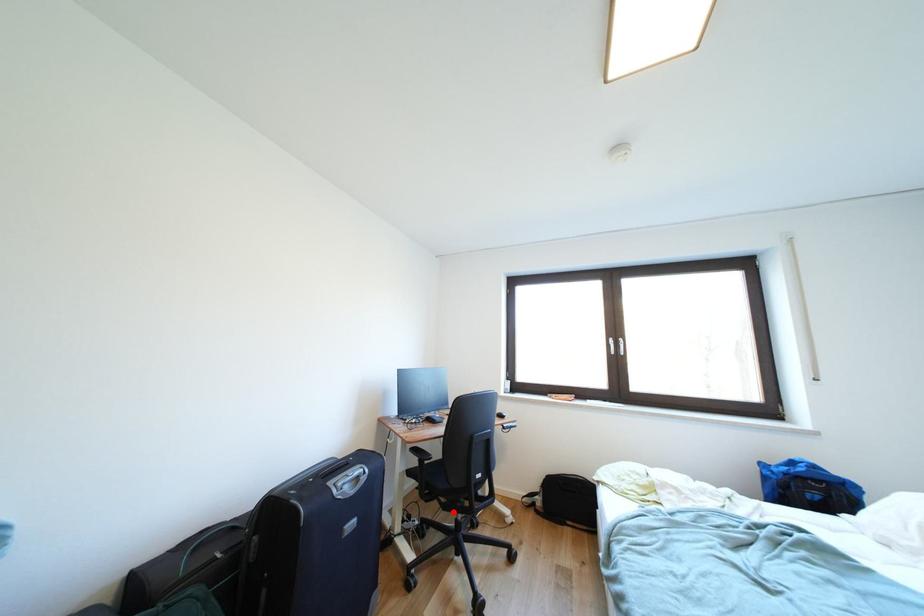
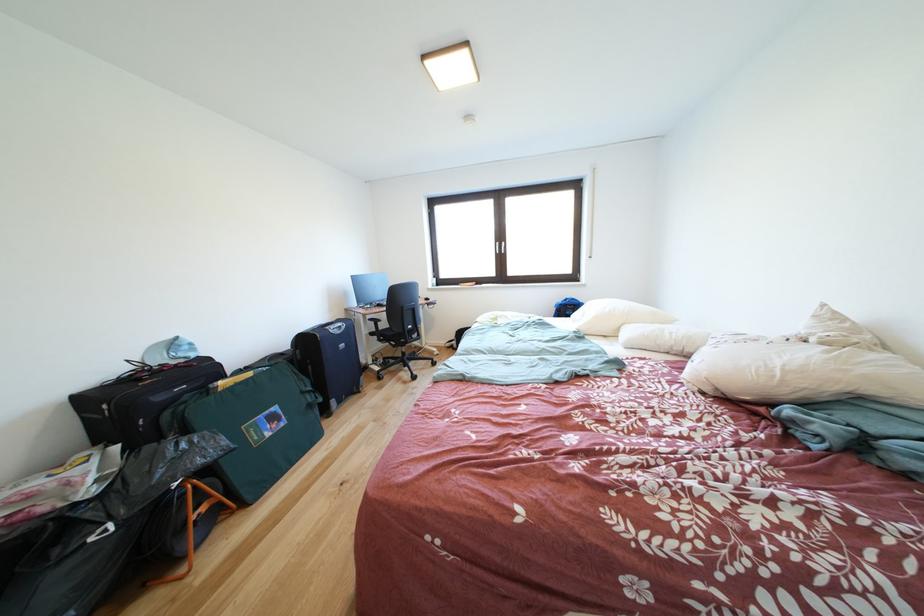
Question: I am providing you with two images of the same scene from different viewpoints. Given a red point in image1, look at the same physical point in image2. Is it:

Choices:
 (A) Closer to the viewpoint
 (B) Farther from the viewpoint

Answer: (A)